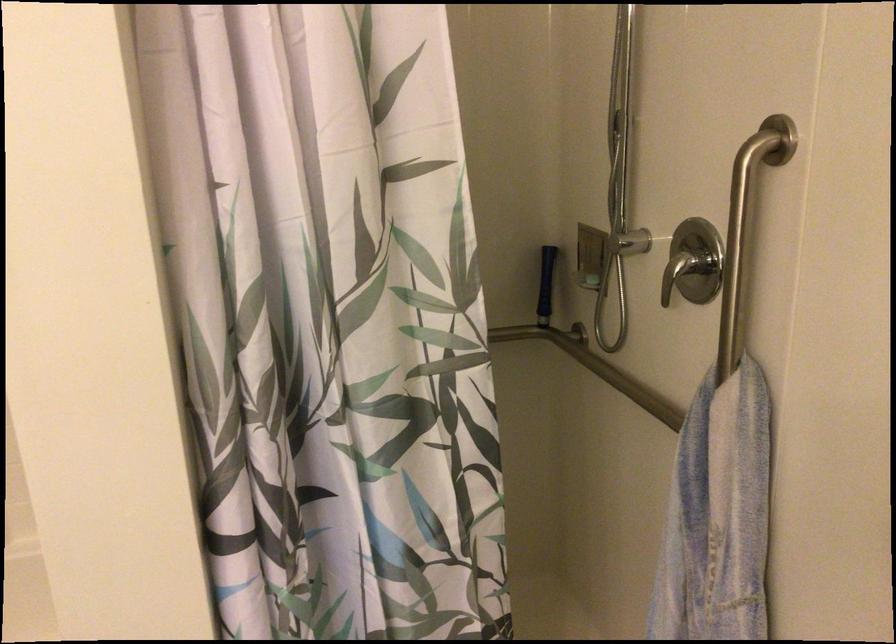
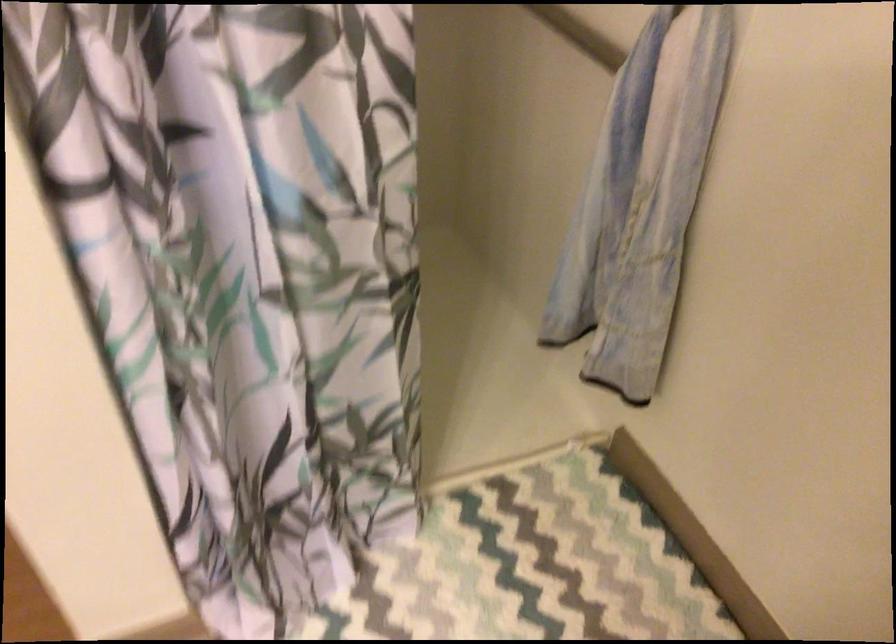
Question: Based on the continuous images, in which direction is the camera rotating? Reply with the corresponding letter.

Choices:
 (A) Left
 (B) Right
 (C) Up
 (D) Down

Answer: (D)